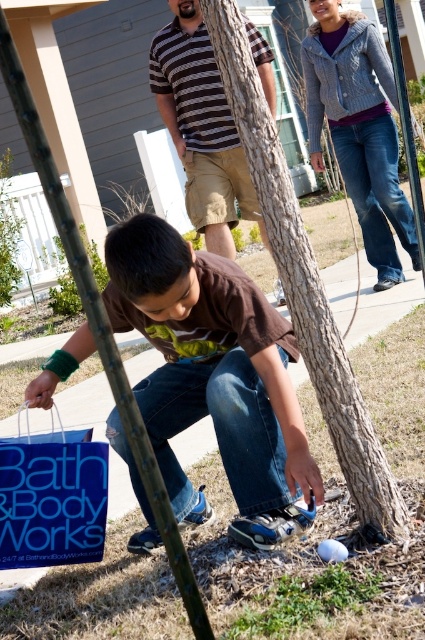
You are a delivery person who needs to place a small package on the ground near the blue paper shopping bag at lower left. Considering the space around the brown textured bark at center, will the package fit without being too close to the bark?

The brown textured bark at center is larger in size than the blue paper shopping bag at lower left. Since the package is small, it can be placed near the blue paper shopping bag at lower left while maintaining enough distance from the larger brown textured bark at center.

In the scene shown: You are a photographer trying to capture a closeup of the brown textured bark at center and the knitted gray sweater at upper right. Since the bark is shorter than the sweater, where should you position your camera to ensure both are in frame without cropping?

Since the brown textured bark at center is shorter than the knitted gray sweater at upper right, position your camera lower to include the entire bark while still capturing the sweater at the upper part of the frame.

You are standing at the position of the young boy in the image. You want to pick up the blue paper shopping bag at lower left. Is the brown textured bark at center blocking your path to the bag?

The brown textured bark at center is in front of the blue paper shopping bag at lower left, so it is blocking your path to the bag.